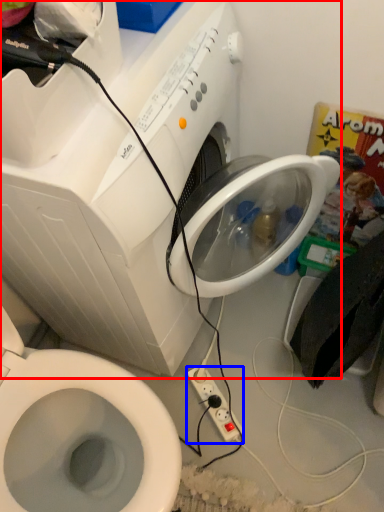
Question: Which of the following is the closest to the observer, washing machine (highlighted by a red box) or power plugs and sockets (highlighted by a blue box)?

Choices:
 (A) washing machine
 (B) power plugs and sockets

Answer: (A)